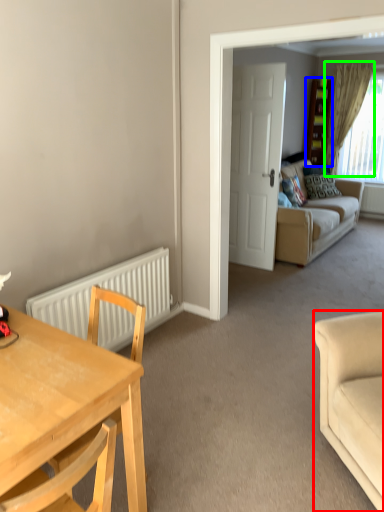
Question: Which object is positioned closest to studio couch (highlighted by a red box)? Select from cabinetry (highlighted by a blue box) and curtain (highlighted by a green box).

Choices:
 (A) cabinetry
 (B) curtain

Answer: (B)